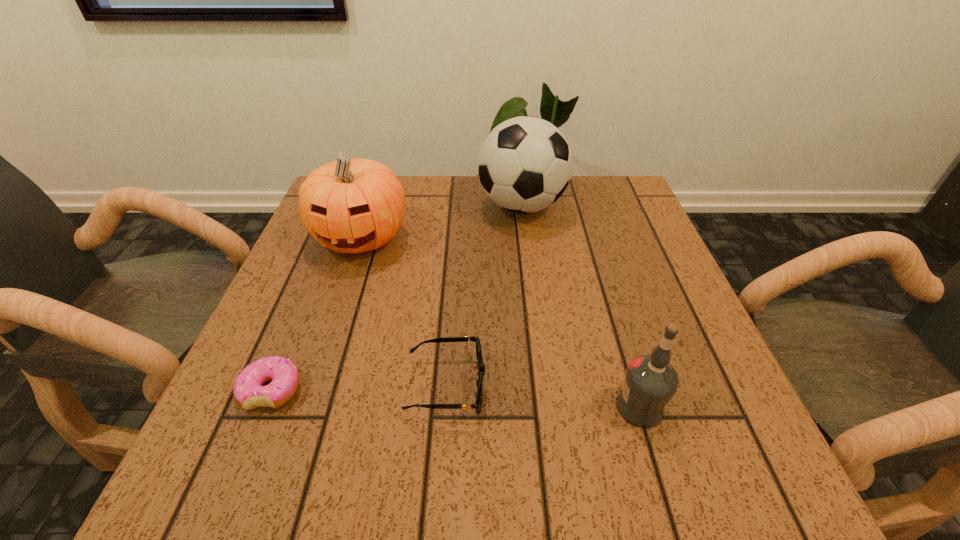
This screenshot has height=540, width=960. I want to click on free spot located 0.260m on the front-facing side of the sunglasses, so click(637, 386).

This screenshot has width=960, height=540. Identify the location of free space located 0.100m on the front of the doughnut. (235, 478).

Locate an element on the screen. This screenshot has width=960, height=540. soccer ball that is at the far edge is located at coordinates pos(524,165).

Identify the location of pumpkin that is at the far edge. This screenshot has height=540, width=960. (352, 205).

The image size is (960, 540). I want to click on pumpkin that is at the left edge, so click(352, 205).

I want to click on doughnut at the left edge, so click(249, 393).

Where is `object at the right edge`? The image size is (960, 540). object at the right edge is located at coordinates (650, 382).

The image size is (960, 540). I want to click on object situated at the far left corner, so click(x=352, y=205).

The width and height of the screenshot is (960, 540). Identify the location of vacant space at the far edge. (477, 179).

Identify the location of vacant space at the near edge of the desktop. (460, 478).